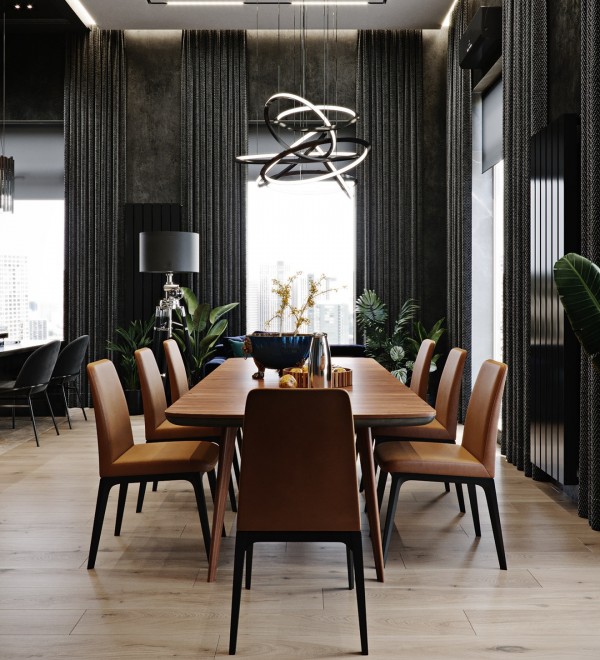
Where is `lamp`? Image resolution: width=600 pixels, height=660 pixels. lamp is located at coordinates (172, 240).